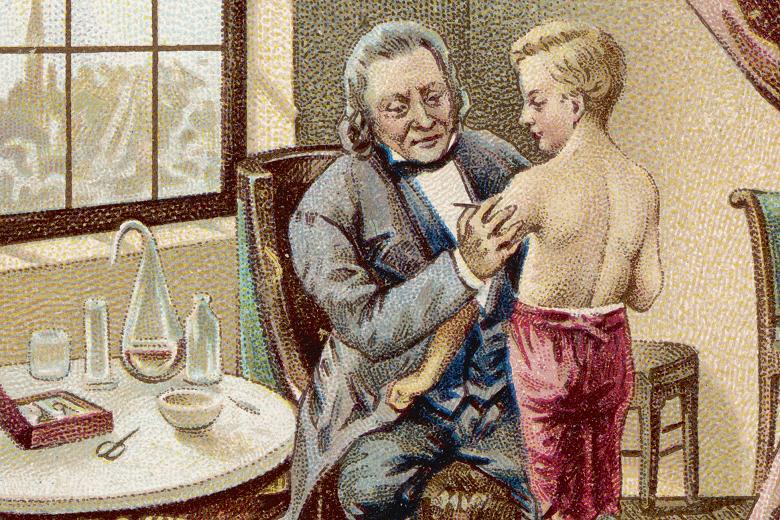
This screenshot has width=780, height=520. Find the location of `wall`. wall is located at coordinates (722, 373).